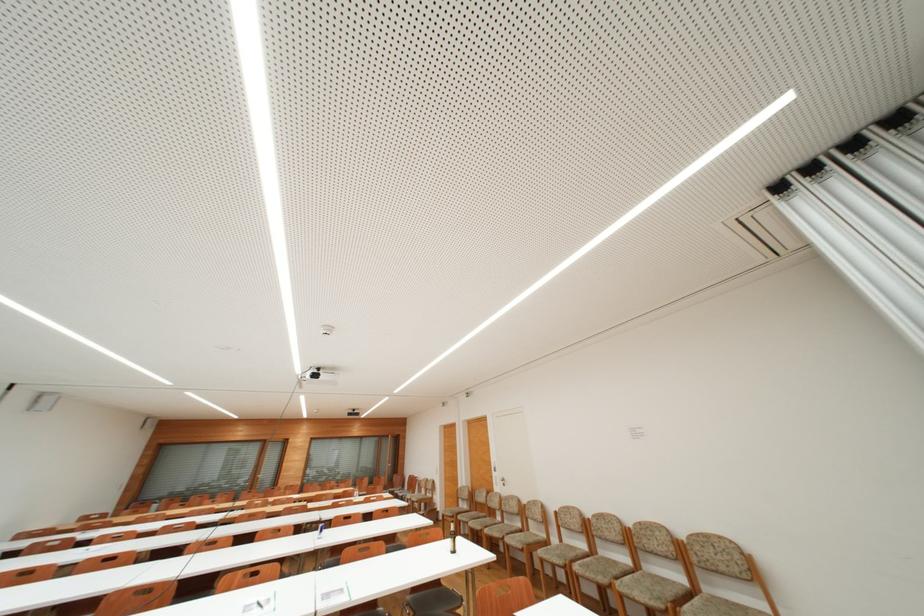
Which object does [453,537] point to?

It refers to a brown glass bottle.